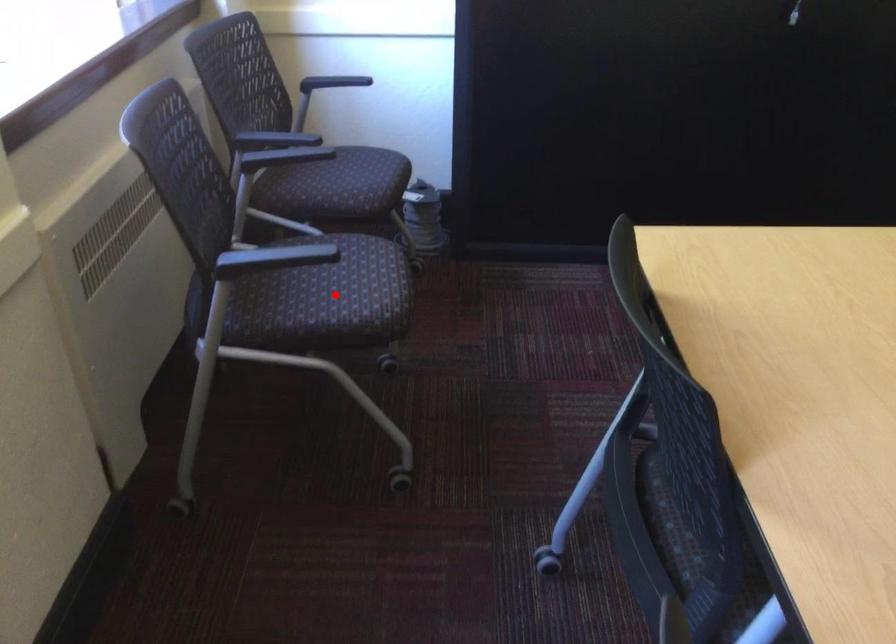
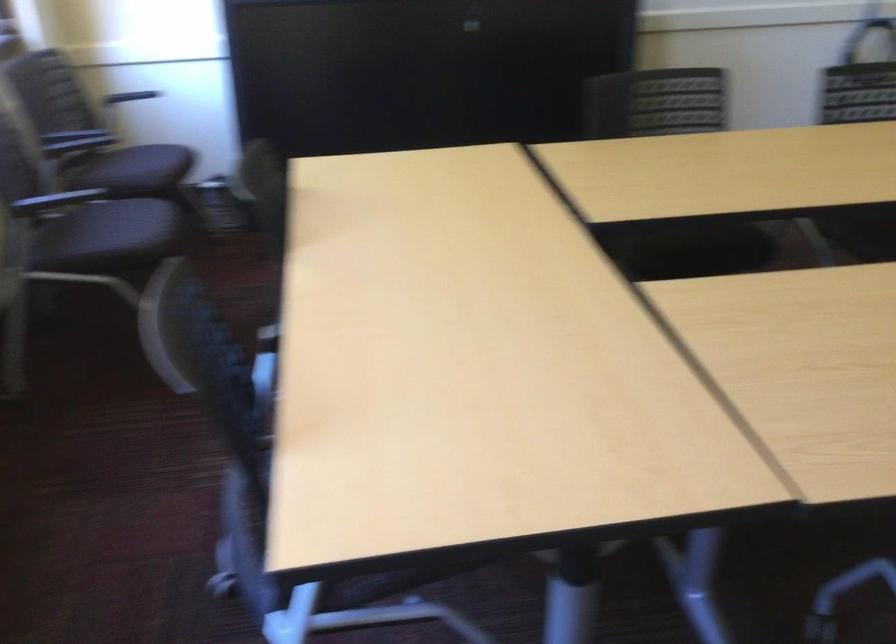
The point at the highlighted location is marked in the first image. Where is the corresponding point in the second image?

(116, 234)